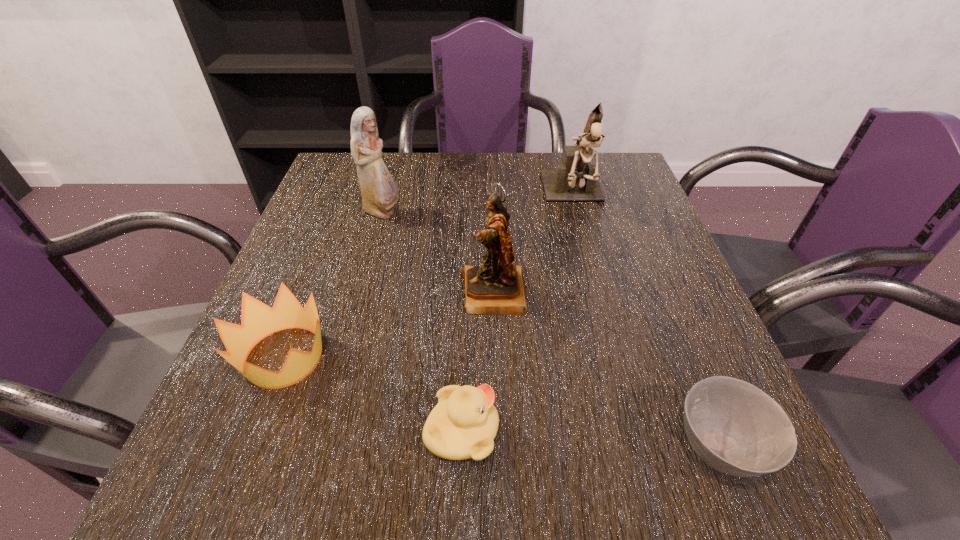
The width and height of the screenshot is (960, 540). I want to click on the rightmost figurine, so click(x=574, y=180).

You are a GUI agent. You are given a task and a screenshot of the screen. Output one action in this format:
    pyautogui.click(x=<x>, y=<y>)
    Task: Click on the leftmost figurine
    The width and height of the screenshot is (960, 540).
    Given the screenshot: What is the action you would take?
    pyautogui.click(x=379, y=192)

Where is `the nearest figurine`? The height and width of the screenshot is (540, 960). the nearest figurine is located at coordinates (496, 287).

The width and height of the screenshot is (960, 540). In order to click on crown in this screenshot , I will do `click(258, 320)`.

At what (x,y) coordinates should I click in order to perform the action: click on duckling. Please return your answer as a coordinate pair (x, y). Looking at the image, I should click on (463, 425).

In order to click on bowl in this screenshot , I will do (734, 427).

Where is `vacant space located 0.160m on the front-facing side of the rightmost figurine`? The height and width of the screenshot is (540, 960). vacant space located 0.160m on the front-facing side of the rightmost figurine is located at coordinates (594, 269).

Locate an element on the screen. vacant space located on the front-facing side of the leftmost figurine is located at coordinates (426, 213).

Where is `free region located 0.110m on the front-facing side of the nearest figurine`? free region located 0.110m on the front-facing side of the nearest figurine is located at coordinates (405, 293).

Locate an element on the screen. The width and height of the screenshot is (960, 540). vacant space located on the front-facing side of the nearest figurine is located at coordinates (405, 293).